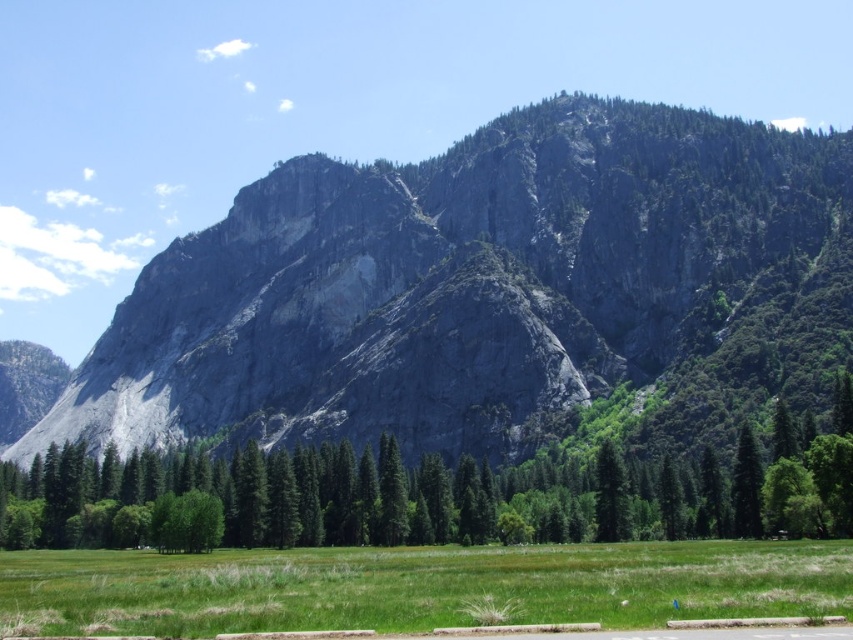
Does gray rock mountain at center come behind green leafy tree at center?

Yes, it is behind green leafy tree at center.

The width and height of the screenshot is (853, 640). What do you see at coordinates (490, 291) in the screenshot?
I see `gray rock mountain at center` at bounding box center [490, 291].

Identify the location of gray rock mountain at center. Image resolution: width=853 pixels, height=640 pixels. (490, 291).

Can you confirm if green leafy tree at center is thinner than green matte tree at center?

No, green leafy tree at center is not thinner than green matte tree at center.

Between point (143, 483) and point (618, 467), which one is positioned behind?

Point (143, 483)

What do you see at coordinates (289, 497) in the screenshot? I see `green leafy tree at center` at bounding box center [289, 497].

Locate an element on the screen. green leafy tree at center is located at coordinates (x=289, y=497).

Can you confirm if gray rock mountain at center is shorter than green matte tree at center?

No.

Does gray rock mountain at center appear over green matte tree at center?

Yes.

The height and width of the screenshot is (640, 853). I want to click on gray rock mountain at center, so click(490, 291).